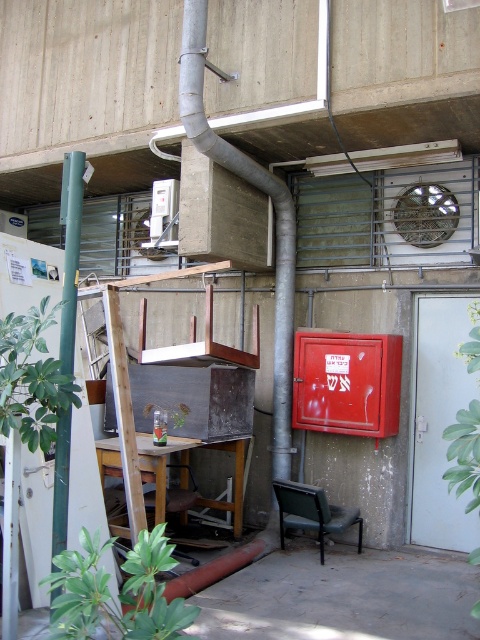
You are standing in the outdoor utility area and want to locate the point at coordinates (71,252). Based on the scene description, where exactly is this point located?

The point at coordinates (71,252) is on the green matte pole at left.

You are an inspector checking the utility area. You need to determine which object has a greater width between the silver metallic pipe at upper center and the green matte pole at left. Which one is wider?

The silver metallic pipe at upper center is wider than the green matte pole at left according to the description.

You are standing in the utility area and need to locate the silver metallic pipe at upper center. According to the coordinates provided, where exactly would you find it?

The silver metallic pipe at upper center is located at the coordinate point of (275, 218).